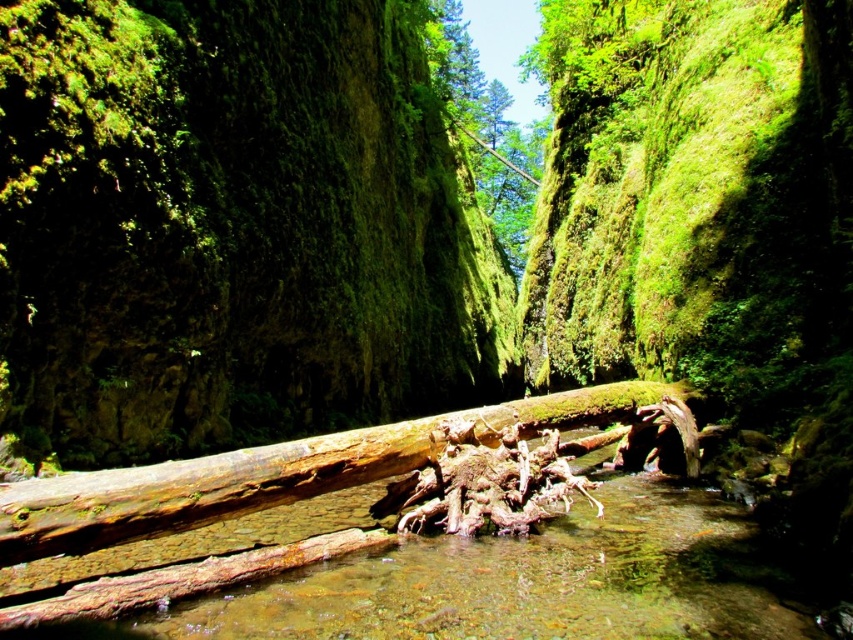
Question: Does smooth brown log at center appear on the left side of green mossy tree at center?

Choices:
 (A) yes
 (B) no

Answer: (A)

Question: Which point is farther to the camera?

Choices:
 (A) smooth brown log at center
 (B) green mossy tree at center

Answer: (B)

Question: Can you confirm if smooth brown log at center is positioned to the left of green mossy tree at center?

Choices:
 (A) no
 (B) yes

Answer: (B)

Question: Is smooth brown log at center below green mossy tree at center?

Choices:
 (A) yes
 (B) no

Answer: (A)

Question: Which point is farther from the camera taking this photo?

Choices:
 (A) (483, 432)
 (B) (456, 104)

Answer: (B)